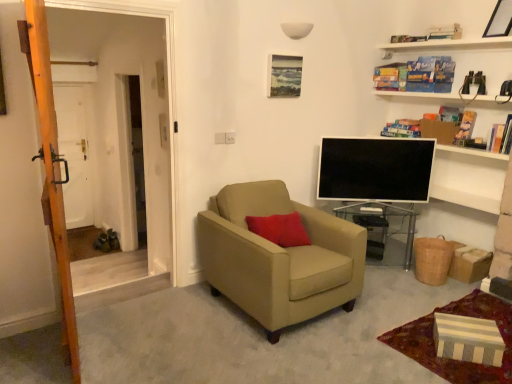
Locate an element on the screen. The height and width of the screenshot is (384, 512). unoccupied area in front of transparent glass table at center is located at coordinates (397, 286).